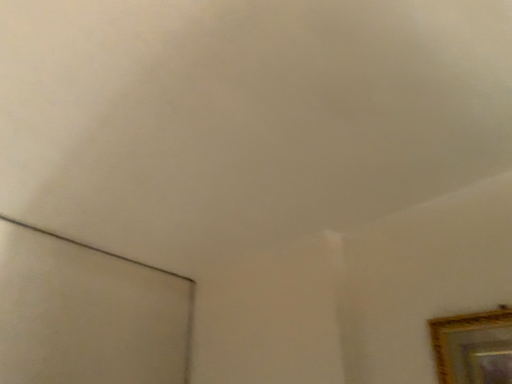
Locate an element on the screen. This screenshot has width=512, height=384. gold wooden picture frame at lower right is located at coordinates (473, 347).

The width and height of the screenshot is (512, 384). What do you see at coordinates (473, 347) in the screenshot? I see `gold wooden picture frame at lower right` at bounding box center [473, 347].

Measure the distance between gold wooden picture frame at lower right and camera.

They are 28.71 inches apart.

At what (x,y) coordinates should I click in order to perform the action: click on gold wooden picture frame at lower right. Please return your answer as a coordinate pair (x, y). Looking at the image, I should click on (473, 347).